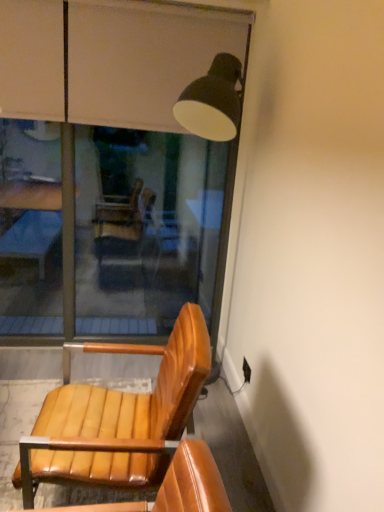
Describe the element at coordinates (107, 229) in the screenshot. The height and width of the screenshot is (512, 384). I see `transparent glass window at upper center` at that location.

At what (x,y) coordinates should I click in order to perform the action: click on transparent glass window at upper center. Please return your answer as a coordinate pair (x, y). Looking at the image, I should click on (107, 229).

Find the location of a particular element. Image resolution: width=384 pixels, height=512 pixels. leather wood chair at lower left is located at coordinates (118, 419).

Describe the element at coordinates (118, 419) in the screenshot. The height and width of the screenshot is (512, 384). I see `leather wood chair at lower left` at that location.

In order to face leather wood chair at lower left, should I rotate leftwards or rightwards?

Rotate your view left by about 10.477°.

Where is `transparent glass window at upper center`? The width and height of the screenshot is (384, 512). transparent glass window at upper center is located at coordinates (107, 229).

Which is more to the left, leather wood chair at lower left or transparent glass window at upper center?

Positioned to the left is transparent glass window at upper center.

Looking at this image, which is in front, leather wood chair at lower left or transparent glass window at upper center?

leather wood chair at lower left.

Considering the positions of point (195, 356) and point (144, 205), is point (195, 356) closer or farther from the camera than point (144, 205)?

Point (195, 356).

From the picture: From the image's perspective, relative to transparent glass window at upper center, is leather wood chair at lower left above or below?

leather wood chair at lower left is situated lower than transparent glass window at upper center in the image.

Consider the image. From a real-world perspective, is leather wood chair at lower left above or below transparent glass window at upper center?

leather wood chair at lower left is below transparent glass window at upper center.

Which object is thinner, leather wood chair at lower left or transparent glass window at upper center?

transparent glass window at upper center is thinner.

Which of these two, leather wood chair at lower left or transparent glass window at upper center, stands shorter?

leather wood chair at lower left is shorter.

In the scene shown: Based on their sizes in the image, would you say leather wood chair at lower left is bigger or smaller than transparent glass window at upper center?

leather wood chair at lower left is smaller than transparent glass window at upper center.

Is leather wood chair at lower left outside of transparent glass window at upper center?

Absolutely, leather wood chair at lower left is external to transparent glass window at upper center.

Are leather wood chair at lower left and transparent glass window at upper center beside each other?

No, leather wood chair at lower left is not beside transparent glass window at upper center.

Is leather wood chair at lower left turned away from transparent glass window at upper center?

No.

In the scene shown: Can you tell me how much leather wood chair at lower left and transparent glass window at upper center differ in facing direction?

The angular difference between leather wood chair at lower left and transparent glass window at upper center is 93.6 degrees.

Consider the image. How distant is leather wood chair at lower left from transparent glass window at upper center?

leather wood chair at lower left and transparent glass window at upper center are 1.49 meters apart.

Identify the location of glass window that is above the leather wood chair at lower left (from the image's perspective). The height and width of the screenshot is (512, 384). (107, 229).

Visually, is transparent glass window at upper center positioned to the left or to the right of leather wood chair at lower left?

transparent glass window at upper center is positioned on leather wood chair at lower left's left side.

Is transparent glass window at upper center closer to camera compared to leather wood chair at lower left?

No, transparent glass window at upper center is further to the viewer.

Does point (91, 231) come in front of point (143, 475)?

That is False.

From the image's perspective, which is above, transparent glass window at upper center or leather wood chair at lower left?

transparent glass window at upper center is shown above in the image.

From a real-world perspective, is transparent glass window at upper center physically above leather wood chair at lower left?

Yes, from a real-world perspective, transparent glass window at upper center is over leather wood chair at lower left

Considering the sizes of transparent glass window at upper center and leather wood chair at lower left in the image, is transparent glass window at upper center wider or thinner than leather wood chair at lower left?

Clearly, transparent glass window at upper center has less width compared to leather wood chair at lower left.

Does transparent glass window at upper center have a lesser height compared to leather wood chair at lower left?

Incorrect, the height of transparent glass window at upper center does not fall short of that of leather wood chair at lower left.

Who is bigger, transparent glass window at upper center or leather wood chair at lower left?

With larger size is transparent glass window at upper center.

Would you say leather wood chair at lower left is part of transparent glass window at upper center's contents?

No, transparent glass window at upper center does not contain leather wood chair at lower left.

Is transparent glass window at upper center positioned far away from leather wood chair at lower left?

Yes, transparent glass window at upper center and leather wood chair at lower left are located far from each other.

Could you tell me if transparent glass window at upper center is turned towards leather wood chair at lower left?

Yes.

Measure the distance between transparent glass window at upper center and leather wood chair at lower left.

transparent glass window at upper center and leather wood chair at lower left are 1.49 meters apart from each other.

You are a GUI agent. You are given a task and a screenshot of the screen. Output one action in this format:
    pyautogui.click(x=<x>, y=<y>)
    Task: Click on the glass window to the left of leather wood chair at lower left
    The height and width of the screenshot is (512, 384).
    Given the screenshot: What is the action you would take?
    pyautogui.click(x=107, y=229)

Identify the location of glass window on the left of leather wood chair at lower left. (107, 229).

Locate an element on the screen. glass window above the leather wood chair at lower left (from the image's perspective) is located at coordinates (107, 229).